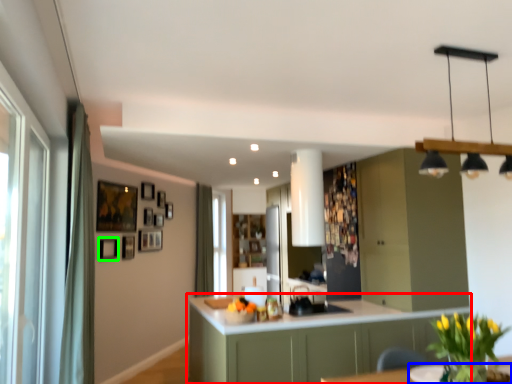
Question: Which object is the closest to the cabinetry (highlighted by a red box)? Choose among these: round table (highlighted by a blue box) or picture frame (highlighted by a green box).

Choices:
 (A) round table
 (B) picture frame

Answer: (A)